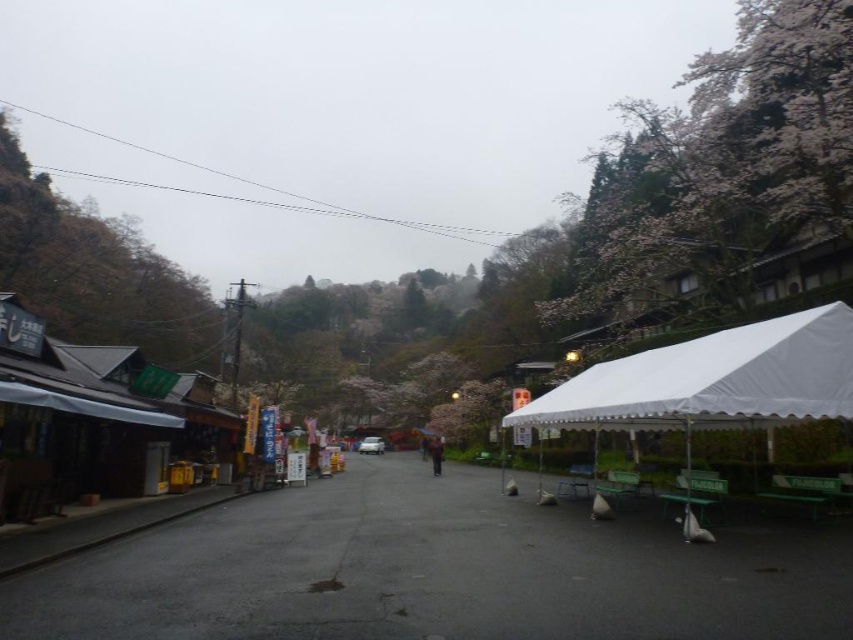
You are standing on the street in the image and want to reach a specific location marked by the point at coordinates (581,376). If you can walk at a speed of 1.2 meters per second, approximately how many seconds will it take you to reach that point?

The point at coordinates (581,376) is 19.52 meters away from you. At a walking speed of 1.2 meters per second, it would take approximately 16.27 seconds to reach that point.

You are standing at the center of the street looking forward. There are two points marked in the image, point 1 at coordinates point (764, 326) and point 2 at point (70, 291). Which point is closer to you?

Point (764, 326) is closer to the camera than point (70, 291).

You are a traveler walking down the street and notice the white fabric tent at right and the dark blue jacket at center. Which object is taller when viewed from your perspective?

The white fabric tent at right is taller than the dark blue jacket at center.